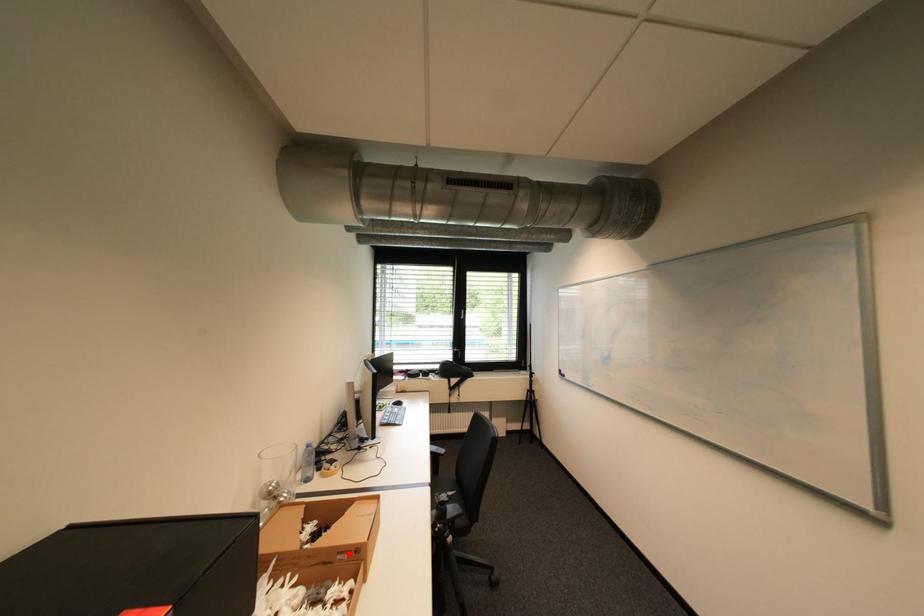
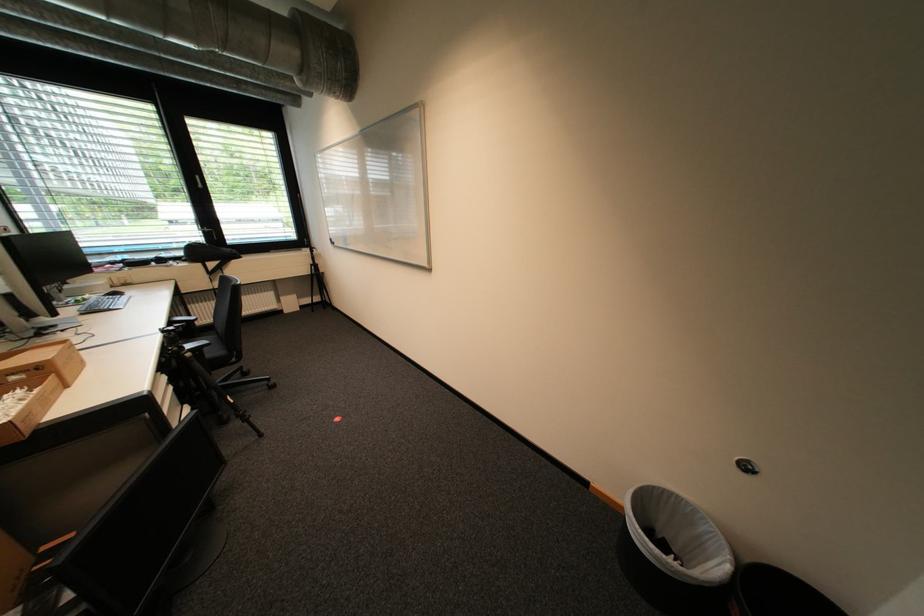
The point at the highlighted location is marked in the first image. Where is the corresponding point in the second image?

(20, 375)